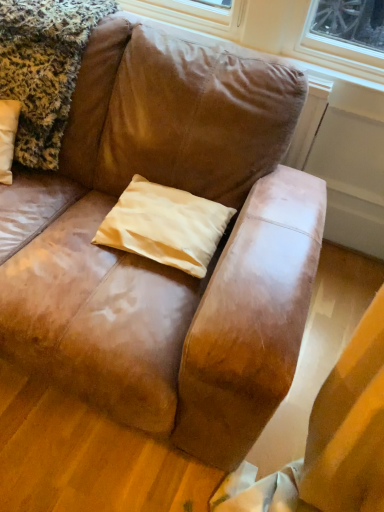
The image size is (384, 512). What are the coordinates of `fluffy leopard print blanket at upper left` in the screenshot? It's located at (44, 68).

The width and height of the screenshot is (384, 512). Describe the element at coordinates (44, 68) in the screenshot. I see `fluffy leopard print blanket at upper left` at that location.

The width and height of the screenshot is (384, 512). What do you see at coordinates (165, 226) in the screenshot?
I see `beige satin pillow at center` at bounding box center [165, 226].

Measure the distance between point [134,192] and camera.

Point [134,192] is 1.28 meters away from camera.

Identify the location of beige satin pillow at center. (165, 226).

Locate an element on the screen. fluffy leopard print blanket at upper left is located at coordinates (44, 68).

Can you confirm if fluffy leopard print blanket at upper left is positioned to the right of beige satin pillow at center?

No, fluffy leopard print blanket at upper left is not to the right of beige satin pillow at center.

Considering the positions of objects fluffy leopard print blanket at upper left and beige satin pillow at center in the image provided, who is in front, fluffy leopard print blanket at upper left or beige satin pillow at center?

Positioned in front is fluffy leopard print blanket at upper left.

Is point (50, 140) closer or farther from the camera than point (179, 266)?

Point (50, 140) is positioned farther from the camera compared to point (179, 266).

From the image's perspective, does fluffy leopard print blanket at upper left appear higher than beige satin pillow at center?

Yes, from the image's perspective, fluffy leopard print blanket at upper left is over beige satin pillow at center.

From a real-world perspective, between fluffy leopard print blanket at upper left and beige satin pillow at center, who is vertically lower?

From a 3D spatial view, beige satin pillow at center is below.

Can you confirm if fluffy leopard print blanket at upper left is thinner than beige satin pillow at center?

No.

Which of these two, fluffy leopard print blanket at upper left or beige satin pillow at center, stands taller?

fluffy leopard print blanket at upper left.

Does fluffy leopard print blanket at upper left have a smaller size compared to beige satin pillow at center?

No.

Is fluffy leopard print blanket at upper left situated inside beige satin pillow at center or outside?

fluffy leopard print blanket at upper left is not enclosed by beige satin pillow at center.

Are fluffy leopard print blanket at upper left and beige satin pillow at center making contact?

They are not placed beside each other.

Is fluffy leopard print blanket at upper left turned away from beige satin pillow at center?

fluffy leopard print blanket at upper left is not turned away from beige satin pillow at center.

You are a GUI agent. You are given a task and a screenshot of the screen. Output one action in this format:
    pyautogui.click(x=<x>, y=<y>)
    Task: Click on the blanket located above the beige satin pillow at center (from the image's perspective)
    
    Given the screenshot: What is the action you would take?
    pos(44,68)

Considering the relative positions of beige satin pillow at center and fluffy leopard print blanket at upper left in the image provided, is beige satin pillow at center to the left or to the right of fluffy leopard print blanket at upper left?

In the image, beige satin pillow at center appears on the right side of fluffy leopard print blanket at upper left.

Is the position of beige satin pillow at center more distant than that of fluffy leopard print blanket at upper left?

Yes, beige satin pillow at center is further from the camera.

Which is farther, (206, 206) or (37, 75)?

The point (37, 75) is behind.

From the image's perspective, which one is positioned lower, beige satin pillow at center or fluffy leopard print blanket at upper left?

beige satin pillow at center is shown below in the image.

From a real-world perspective, who is located lower, beige satin pillow at center or fluffy leopard print blanket at upper left?

beige satin pillow at center, from a real-world perspective.

Which of these two, beige satin pillow at center or fluffy leopard print blanket at upper left, is wider?

Wider between the two is fluffy leopard print blanket at upper left.

Considering the sizes of beige satin pillow at center and fluffy leopard print blanket at upper left in the image, is beige satin pillow at center taller or shorter than fluffy leopard print blanket at upper left?

In the image, beige satin pillow at center appears to be shorter than fluffy leopard print blanket at upper left.

Is beige satin pillow at center smaller than fluffy leopard print blanket at upper left?

Indeed, beige satin pillow at center has a smaller size compared to fluffy leopard print blanket at upper left.

Is beige satin pillow at center inside the boundaries of fluffy leopard print blanket at upper left, or outside?

beige satin pillow at center is not enclosed by fluffy leopard print blanket at upper left.

Is there a large distance between beige satin pillow at center and fluffy leopard print blanket at upper left?

beige satin pillow at center is actually quite close to fluffy leopard print blanket at upper left.

Is beige satin pillow at center turned away from fluffy leopard print blanket at upper left?

No, beige satin pillow at center is not facing away from fluffy leopard print blanket at upper left.

How different are the orientations of beige satin pillow at center and fluffy leopard print blanket at upper left in degrees?

The angular difference between beige satin pillow at center and fluffy leopard print blanket at upper left is 1.58 degrees.

I want to click on pillow lying behind the fluffy leopard print blanket at upper left, so click(x=165, y=226).

Locate an element on the screen. The image size is (384, 512). blanket positioned vertically above the beige satin pillow at center (from a real-world perspective) is located at coordinates (44, 68).

Identify the location of pillow below the fluffy leopard print blanket at upper left (from the image's perspective). (165, 226).